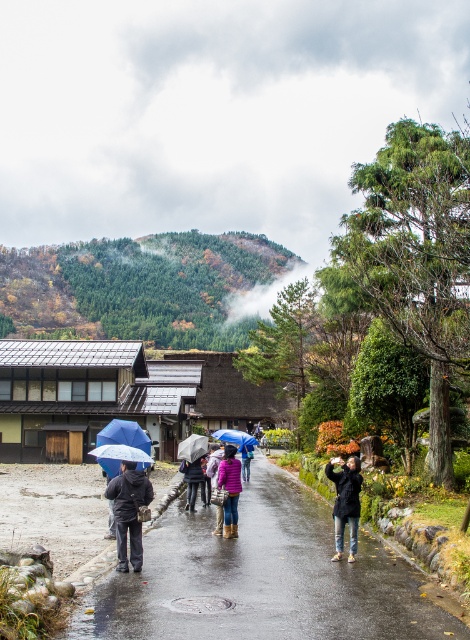
Who is more forward, (x=336, y=540) or (x=194, y=502)?

Point (x=336, y=540)

Does dark brown fur coat at lower right come in front of dark blue jacket at center?

Yes, it is.

Measure the distance between point (338,476) and camera.

Point (338,476) is 13.56 meters from camera.

Identify the location of dark brown fur coat at lower right. The image size is (470, 640). (345, 502).

Between point (353, 548) and point (235, 429), which one is positioned in front?

Point (353, 548) is more forward.

Measure the distance between dark brown fur coat at lower right and blue matte umbrella at center.

dark brown fur coat at lower right and blue matte umbrella at center are 41.38 feet apart.

Does point (354, 506) come in front of point (240, 444)?

That is True.

The image size is (470, 640). Identify the location of dark brown fur coat at lower right. (345, 502).

Between dark gray matte jacket at center and blue matte umbrella at center, which one appears on the right side from the viewer's perspective?

blue matte umbrella at center

Is dark gray matte jacket at center further to the viewer compared to blue matte umbrella at center?

No, dark gray matte jacket at center is in front of blue matte umbrella at center.

What are the coordinates of `dark gray matte jacket at center` in the screenshot? It's located at (128, 512).

I want to click on dark gray matte jacket at center, so click(x=128, y=512).